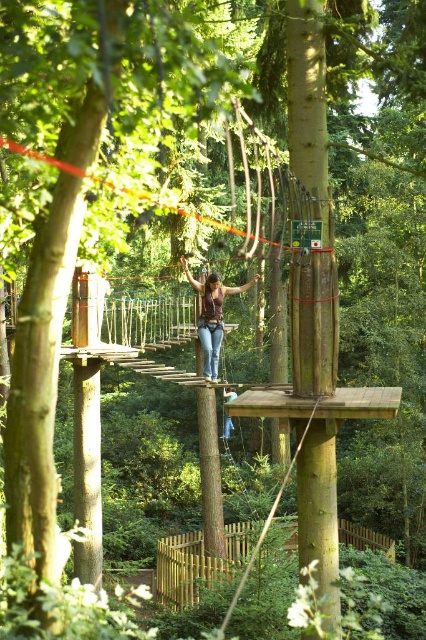
Question: Which point is farther from the camera taking this photo?

Choices:
 (A) coord(222,292)
 (B) coord(51,156)

Answer: (A)

Question: Does brown wooden fence at lower center have a larger size compared to matte brown hair at center?

Choices:
 (A) no
 (B) yes

Answer: (A)

Question: Is brown wooden fence at lower center positioned in front of orange rope bridge at center?

Choices:
 (A) no
 (B) yes

Answer: (A)

Question: Based on their relative distances, which object is farther from the denim jeans at center?

Choices:
 (A) matte brown hair at center
 (B) orange rope bridge at center

Answer: (A)

Question: Which point appears closest to the camera in this image?

Choices:
 (A) (313, 250)
 (B) (250, 284)
 (C) (224, 416)

Answer: (A)

Question: Can you confirm if orange rope bridge at center is wider than matte brown hair at center?

Choices:
 (A) no
 (B) yes

Answer: (B)